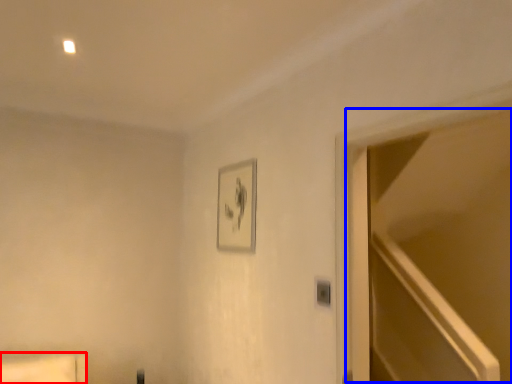
Question: Which of the following is the farthest to the observer, furniture (highlighted by a red box) or glass door (highlighted by a blue box)?

Choices:
 (A) furniture
 (B) glass door

Answer: (A)